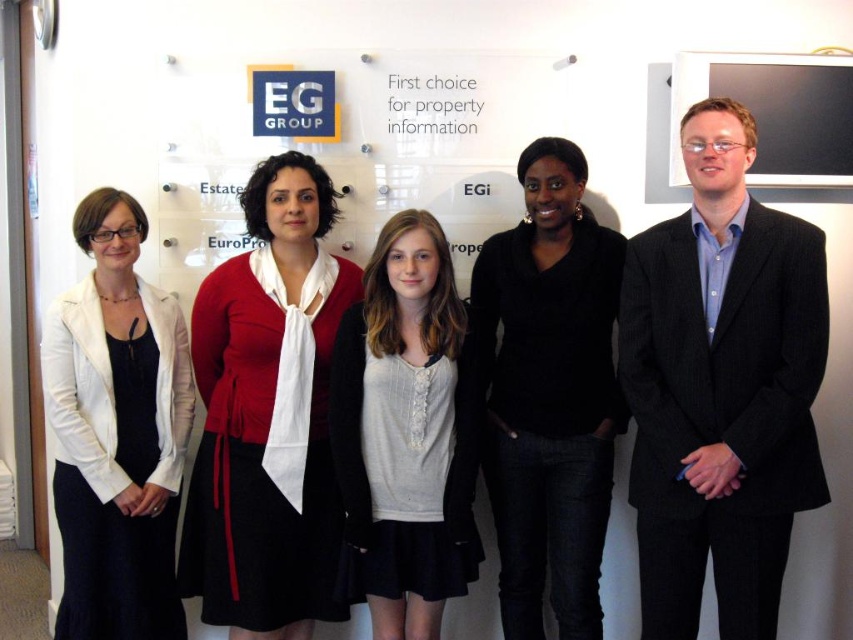
Between white matte blazer at left and black glossy monitor at upper right, which one appears on the right side from the viewer's perspective?

Positioned to the right is black glossy monitor at upper right.

Who is more distant from viewer, (74, 305) or (811, 157)?

Positioned behind is point (811, 157).

This screenshot has width=853, height=640. I want to click on white matte blazer at left, so click(115, 433).

Find the location of `blue pinstripe suit at right`. blue pinstripe suit at right is located at coordinates (721, 387).

Does blue pinstripe suit at right appear over light gray knit sweater at center?

Yes.

Who is more distant from viewer, (645, 520) or (376, 252)?

Point (376, 252)

This screenshot has height=640, width=853. Identify the location of blue pinstripe suit at right. (721, 387).

Does matte red cardigan at center have a lesser width compared to black matte sweater at center?

No, matte red cardigan at center is not thinner than black matte sweater at center.

Is point (259, 598) positioned behind point (550, 193)?

That is False.

This screenshot has width=853, height=640. In order to click on matte red cardigan at center in this screenshot , I will do `click(268, 413)`.